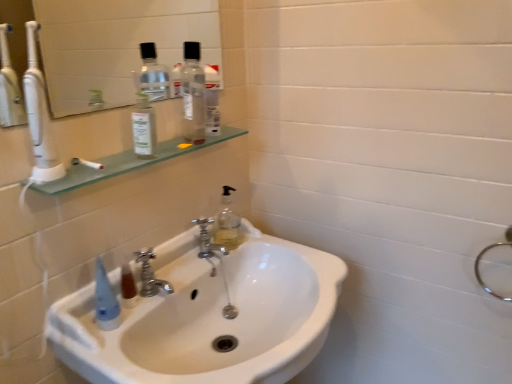
Looking at this image, measure the distance between point (152, 294) and camera.

Point (152, 294) and camera are 95.60 centimeters apart from each other.

The image size is (512, 384). What are the coordinates of `clear glass bottle at upper left, the 1th bottle when ordered from front to back` in the screenshot? It's located at (144, 128).

The height and width of the screenshot is (384, 512). What are the coordinates of `white glossy sink at center` in the screenshot? It's located at (209, 317).

Describe the element at coordinates (207, 240) in the screenshot. I see `silver metallic faucet at center, the second tap viewed from the left` at that location.

Identify the location of transparent glass shelf at upper left. (128, 163).

Is point (125, 285) positioned after point (201, 252)?

No, (125, 285) is in front of (201, 252).

What's the angular difference between translucent plastic mouthwash at sink and silver metallic faucet at center, which is counted as the 2th tap, starting from the front,'s facing directions?

The angle between the facing direction of translucent plastic mouthwash at sink and the facing direction of silver metallic faucet at center, which is counted as the 2th tap, starting from the front, is 3.7 degrees.

Identify the location of the 1st tap above the translucent plastic mouthwash at sink (from a real-world perspective). This screenshot has height=384, width=512. (207, 240).

Does translucent plastic mouthwash at sink contain silver metallic faucet at center, the second tap viewed from the left?

That's incorrect, silver metallic faucet at center, the second tap viewed from the left, is not inside translucent plastic mouthwash at sink.

Considering the sizes of objects transparent plastic bottle at upper center, positioned as the second bottle in left-to-right order, and clear glass bottle at upper left, the 1th bottle when ordered from front to back, in the image provided, who is thinner, transparent plastic bottle at upper center, positioned as the second bottle in left-to-right order, or clear glass bottle at upper left, the 1th bottle when ordered from front to back,?

clear glass bottle at upper left, the 1th bottle when ordered from front to back, is thinner.

Considering the relative positions of transparent plastic bottle at upper center, which ranks as the first bottle in right-to-left order, and clear glass bottle at upper left, the 1th bottle when ordered from front to back, in the image provided, is transparent plastic bottle at upper center, which ranks as the first bottle in right-to-left order, in front of clear glass bottle at upper left, the 1th bottle when ordered from front to back,?

No, it is behind clear glass bottle at upper left, the 1th bottle when ordered from front to back.

Measure the distance from transparent plastic bottle at upper center, which appears as the first bottle when viewed from the back, to clear glass bottle at upper left, the 2th bottle in the back-to-front sequence.

transparent plastic bottle at upper center, which appears as the first bottle when viewed from the back, and clear glass bottle at upper left, the 2th bottle in the back-to-front sequence, are 4.73 inches apart from each other.

Considering the sizes of objects transparent plastic bottle at upper center, positioned as the second bottle in left-to-right order, and clear glass bottle at upper left, the 1th bottle when ordered from front to back, in the image provided, who is taller, transparent plastic bottle at upper center, positioned as the second bottle in left-to-right order, or clear glass bottle at upper left, the 1th bottle when ordered from front to back,?

Standing taller between the two is transparent plastic bottle at upper center, positioned as the second bottle in left-to-right order.

Is transparent plastic bottle at upper center, which appears as the first bottle when viewed from the back, smaller than white glossy sink at center?

Correct, transparent plastic bottle at upper center, which appears as the first bottle when viewed from the back, occupies less space than white glossy sink at center.

Can we say transparent plastic bottle at upper center, positioned as the second bottle in left-to-right order, lies outside white glossy sink at center?

Yes, transparent plastic bottle at upper center, positioned as the second bottle in left-to-right order, is not within white glossy sink at center.

From a real-world perspective, which bottle is the 2nd one above the white glossy sink at center? Please provide its 2D coordinates.

[(193, 94)]

From the picture: From the image's perspective, between transparent plastic bottle at upper center, which appears as the first bottle when viewed from the back, and white glossy sink at center, which one is located above?

transparent plastic bottle at upper center, which appears as the first bottle when viewed from the back, from the image's perspective.

Is silver metallic faucet at center, which is counted as the 1th tap, starting from the right, outside of translucent plastic mouthwash at sink?

silver metallic faucet at center, which is counted as the 1th tap, starting from the right, is positioned outside translucent plastic mouthwash at sink.

Starting from the translucent plastic mouthwash at sink, which tap is the 2nd one behind? Please provide its 2D coordinates.

[(207, 240)]

Based on their sizes in the image, would you say silver metallic faucet at center, which is counted as the 2th tap, starting from the front, is bigger or smaller than translucent plastic mouthwash at sink?

Considering their sizes, silver metallic faucet at center, which is counted as the 2th tap, starting from the front, takes up more space than translucent plastic mouthwash at sink.

Is silver metallic faucet at center, which is counted as the 2th tap, starting from the front, oriented away from translucent plastic mouthwash at sink?

No, translucent plastic mouthwash at sink is not at the back of silver metallic faucet at center, which is counted as the 2th tap, starting from the front.

Does silver metallic faucet at center, which appears as the first tap when viewed from the back, lie behind clear glass mirror at upper left?

Yes, silver metallic faucet at center, which appears as the first tap when viewed from the back, is further from the camera.

Considering the relative sizes of silver metallic faucet at center, which is counted as the 2th tap, starting from the front, and clear glass mirror at upper left in the image provided, is silver metallic faucet at center, which is counted as the 2th tap, starting from the front, thinner than clear glass mirror at upper left?

In fact, silver metallic faucet at center, which is counted as the 2th tap, starting from the front, might be wider than clear glass mirror at upper left.

Are silver metallic faucet at center, the second tap viewed from the left, and clear glass mirror at upper left making contact?

No, silver metallic faucet at center, the second tap viewed from the left, is not touching clear glass mirror at upper left.

Is silver metallic faucet at center, arranged as the second tap when viewed from the back, taller than silver metallic faucet at center, which is counted as the 2th tap, starting from the front?

Incorrect, the height of silver metallic faucet at center, arranged as the second tap when viewed from the back, is not larger of that of silver metallic faucet at center, which is counted as the 2th tap, starting from the front.

Where is `tap below the silver metallic faucet at center, which is counted as the 1th tap, starting from the right (from the image's perspective)`? This screenshot has width=512, height=384. tap below the silver metallic faucet at center, which is counted as the 1th tap, starting from the right (from the image's perspective) is located at coordinates (150, 276).

Based on the photo, relative to silver metallic faucet at center, which is counted as the 1th tap, starting from the right, is silver metallic faucet at center, placed as the 2th tap when sorted from right to left, in front or behind?

Clearly, silver metallic faucet at center, placed as the 2th tap when sorted from right to left, is in front of silver metallic faucet at center, which is counted as the 1th tap, starting from the right.

From the image's perspective, is silver metallic faucet at center, arranged as the second tap when viewed from the back, below silver metallic faucet at center, which is counted as the 1th tap, starting from the right?

Yes, from the image's perspective, silver metallic faucet at center, arranged as the second tap when viewed from the back, is below silver metallic faucet at center, which is counted as the 1th tap, starting from the right.

Which of these two, transparent plastic bottle at upper center, the second bottle viewed from the front, or translucent plastic mouthwash at sink, is smaller?

translucent plastic mouthwash at sink is smaller.

Which is farther from the camera, (197, 121) or (124, 306)?

The point (197, 121) is farther from the camera.

From the image's perspective, is transparent plastic bottle at upper center, which ranks as the first bottle in right-to-left order, over translucent plastic mouthwash at sink?

Yes, from the image's perspective, transparent plastic bottle at upper center, which ranks as the first bottle in right-to-left order, is over translucent plastic mouthwash at sink.

This screenshot has width=512, height=384. I want to click on the 2nd tap to the right of the translucent plastic mouthwash at sink, starting your count from the anchor, so click(207, 240).

What are the coordinates of `bottle to the left of transparent plastic bottle at upper center, positioned as the second bottle in left-to-right order` in the screenshot? It's located at (144, 128).

Considering their positions, is transparent glass shelf at upper left positioned further to silver metallic faucet at center, placed as the 2th tap when sorted from right to left, than silver metallic faucet at center, which is counted as the 2th tap, starting from the front?

Among the two, transparent glass shelf at upper left is located further to silver metallic faucet at center, placed as the 2th tap when sorted from right to left.

Considering their positions, is translucent plastic mouthwash at sink positioned further to transparent glass shelf at upper left than clear glass bottle at upper left, marked as the first bottle in a left-to-right arrangement?

Among the two, translucent plastic mouthwash at sink is located further to transparent glass shelf at upper left.

Looking at the image, which one is located closer to silver metallic faucet at center, which is counted as the 2th tap, starting from the front, silver metallic faucet at center, arranged as the second tap when viewed from the back, or transparent glass shelf at upper left?

The object closer to silver metallic faucet at center, which is counted as the 2th tap, starting from the front, is silver metallic faucet at center, arranged as the second tap when viewed from the back.

From the picture: When comparing their distances from white glossy sink at center, does clear glass bottle at upper left, positioned as the 2th bottle in right-to-left order, or silver metallic faucet at center, acting as the first tap starting from the left, seem further?

clear glass bottle at upper left, positioned as the 2th bottle in right-to-left order, is positioned further to the anchor white glossy sink at center.

Estimate the real-world distances between objects in this image. Which object is further from transparent plastic bottle at upper center, positioned as the second bottle in left-to-right order, clear glass mirror at upper left or white glossy sink at center?

clear glass mirror at upper left is positioned further to the anchor transparent plastic bottle at upper center, positioned as the second bottle in left-to-right order.

Which object lies further to the anchor point transparent glass shelf at upper left, white glossy sink at center or clear glass mirror at upper left?

The object further to transparent glass shelf at upper left is clear glass mirror at upper left.

Which object lies further to the anchor point silver metallic faucet at center, which is counted as the 2th tap, starting from the front, clear glass bottle at upper left, the 2th bottle in the back-to-front sequence, or transparent plastic bottle at upper center, the second bottle viewed from the front?

Among the two, clear glass bottle at upper left, the 2th bottle in the back-to-front sequence, is located further to silver metallic faucet at center, which is counted as the 2th tap, starting from the front.

From the image, which object appears to be farther from white glossy sink at center, clear glass bottle at upper left, marked as the first bottle in a left-to-right arrangement, or translucent plastic mouthwash at sink?

Based on the image, clear glass bottle at upper left, marked as the first bottle in a left-to-right arrangement, appears to be further to white glossy sink at center.

Find the location of `bottle between transparent plastic bottle at upper center, which ranks as the first bottle in right-to-left order, and silver metallic faucet at center, the second tap viewed from the left, from top to bottom`. bottle between transparent plastic bottle at upper center, which ranks as the first bottle in right-to-left order, and silver metallic faucet at center, the second tap viewed from the left, from top to bottom is located at coordinates coord(144,128).

In order to click on tap between translucent plastic mouthwash at sink and silver metallic faucet at center, which is counted as the 2th tap, starting from the front, in the front-back direction in this screenshot , I will do 150,276.

The height and width of the screenshot is (384, 512). What are the coordinates of `bottle positioned between transparent glass shelf at upper left and transparent plastic bottle at upper center, positioned as the second bottle in left-to-right order, from near to far` in the screenshot? It's located at (144, 128).

Where is `tap between transparent glass shelf at upper left and silver metallic faucet at center, the second tap viewed from the left, from front to back`? Image resolution: width=512 pixels, height=384 pixels. tap between transparent glass shelf at upper left and silver metallic faucet at center, the second tap viewed from the left, from front to back is located at coordinates (150, 276).